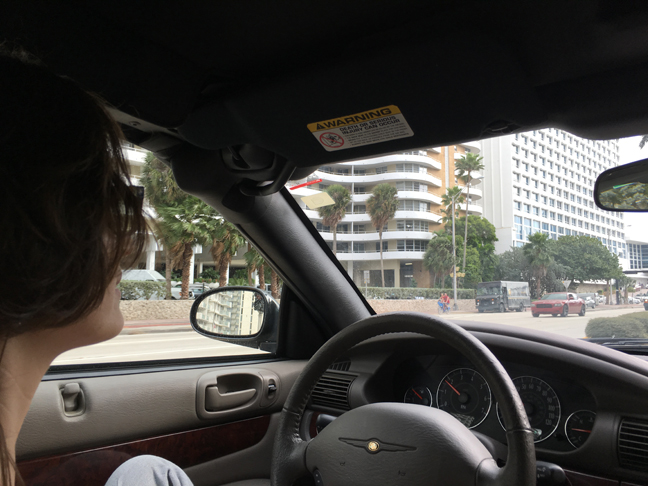
Identify the location of door. The width and height of the screenshot is (648, 486). (157, 409).